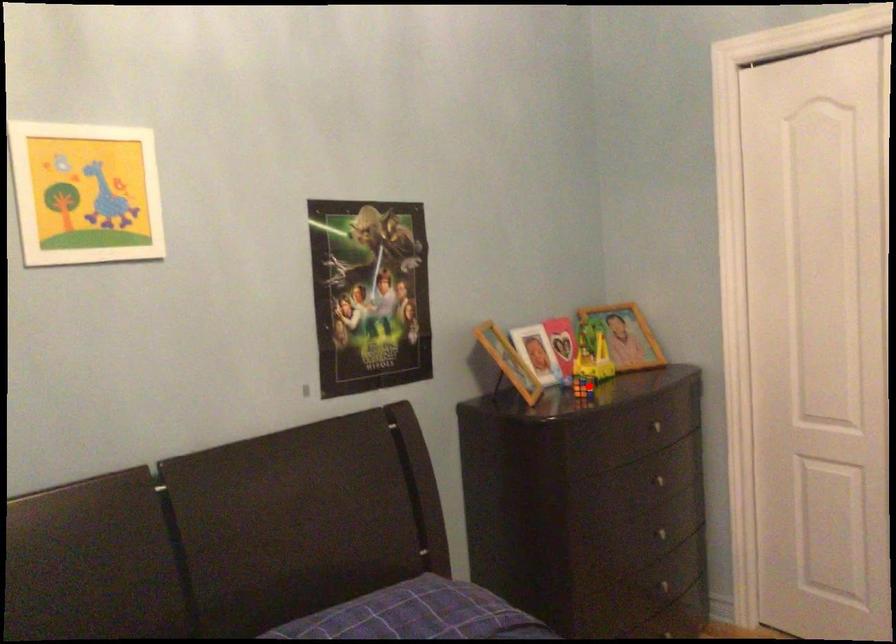
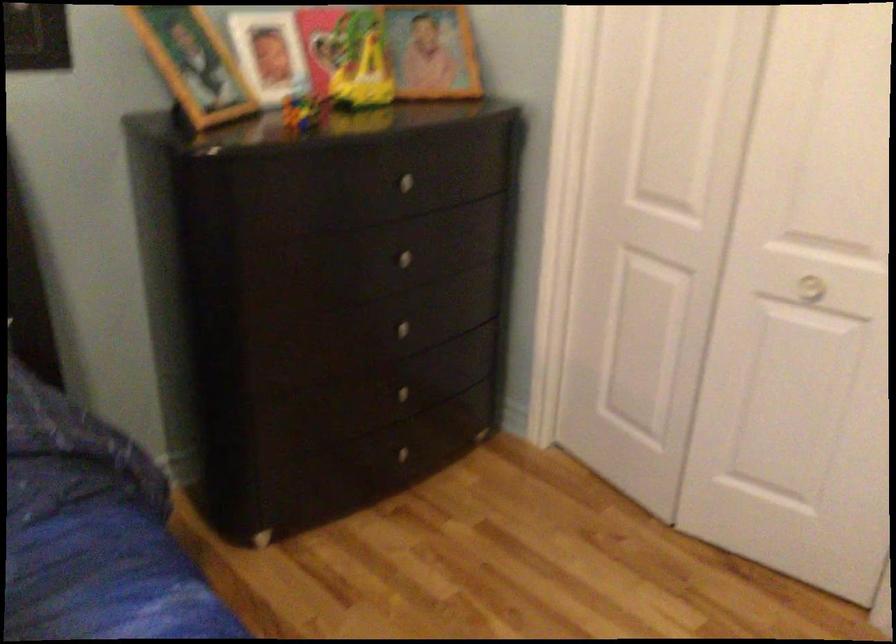
Locate, in the second image, the point that corresponds to the highlighted location in the first image.

(303, 111)